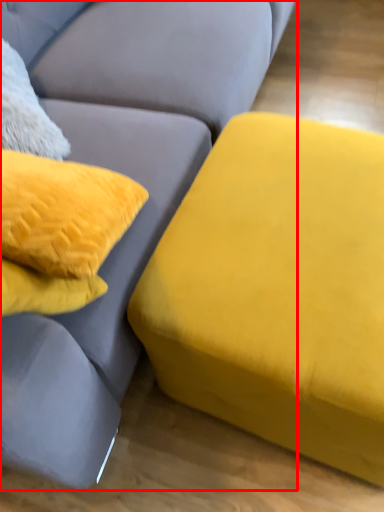
Question: From the image's perspective, where is studio couch (annotated by the red box) located in relation to studio couch in the image?

Choices:
 (A) above
 (B) below

Answer: (A)